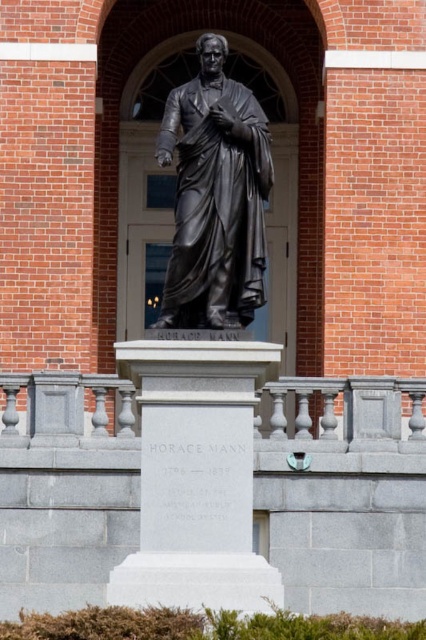
Is point (216, 605) more distant than point (184, 83)?

That is False.

Is white marble pedestal at center to the right of black polished statue at center from the viewer's perspective?

In fact, white marble pedestal at center is to the left of black polished statue at center.

Is point (178, 390) closer to camera compared to point (230, 129)?

Yes, point (178, 390) is closer to viewer.

At what (x,y) coordinates should I click in order to perform the action: click on white marble pedestal at center. Please return your answer as a coordinate pair (x, y). Looking at the image, I should click on (196, 476).